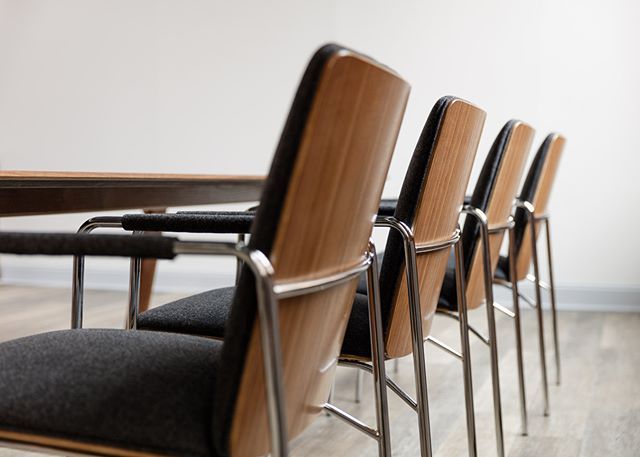
Find the location of a particular element. This screenshot has width=640, height=457. chair seats is located at coordinates (500, 266), (444, 293), (356, 338), (170, 428).